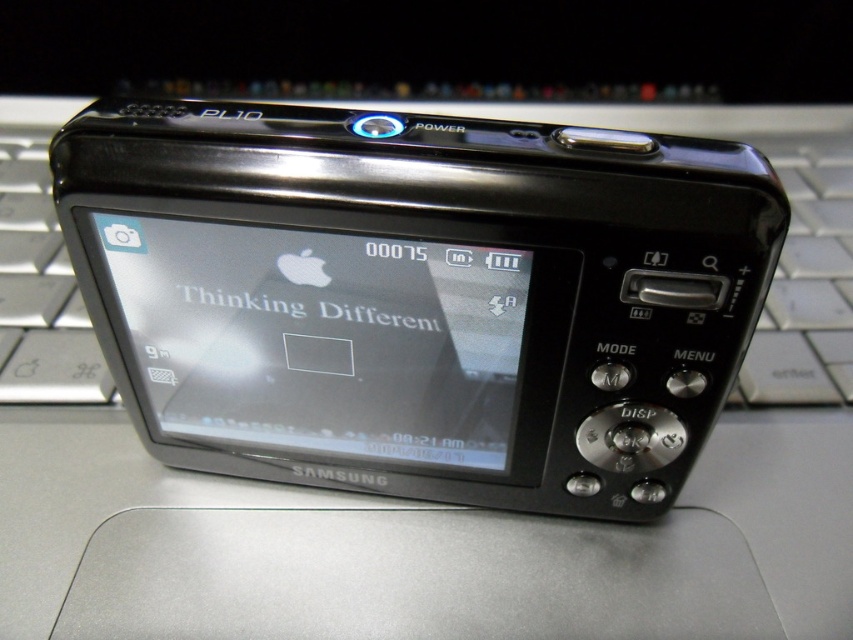
Question: Is matte black screen at center smaller than silver metallic keyboard at center?

Choices:
 (A) no
 (B) yes

Answer: (B)

Question: Is matte black screen at center behind silver metallic keyboard at center?

Choices:
 (A) yes
 (B) no

Answer: (B)

Question: Does matte black screen at center appear under silver metallic keyboard at center?

Choices:
 (A) yes
 (B) no

Answer: (A)

Question: Which of the following is the closest to the observer?

Choices:
 (A) silver metallic keyboard at center
 (B) matte black screen at center

Answer: (B)